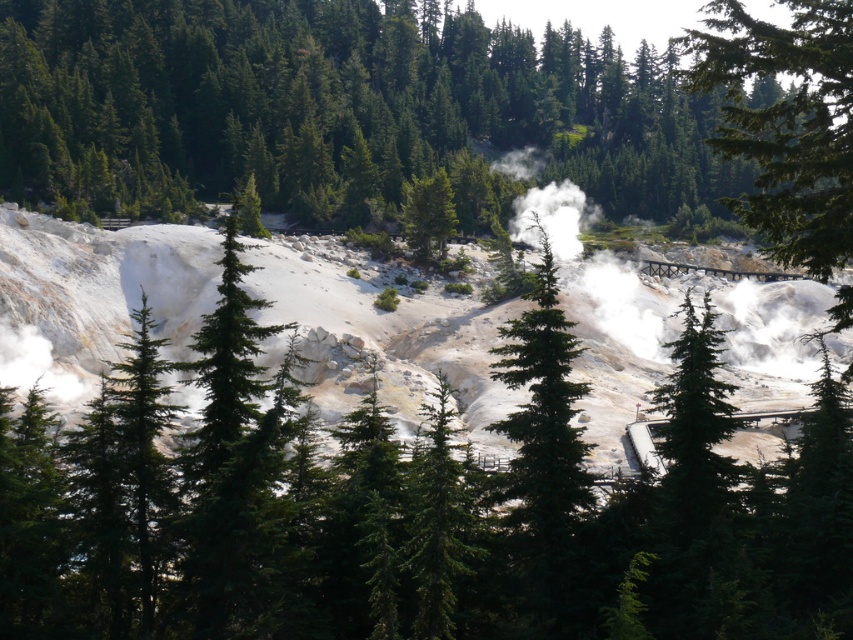
You are a hiker trying to determine which tree is closer to you. You see a green textured tree at center and a green matte tree at center. Which one is closer?

The green textured tree at center is closer because it is in front of the green matte tree at center.

You are standing at the origin point of the coordinate system in the geothermal area. You want to locate the green textured tree at center. What are its coordinates?

The green textured tree at center is located at coordinates (x=786, y=124).

You are standing at the edge of a geothermal area surrounded by dense evergreen trees. You want to take a photo of the point at coordinate point (809, 163). If your camera has a maximum focus range of 25 meters, will you be able to focus on that point?

The distance of point (809, 163) from the camera is 26.91 meters, which exceeds the camera maximum focus range of 25 meters. Therefore, you won not be able to focus on that point.